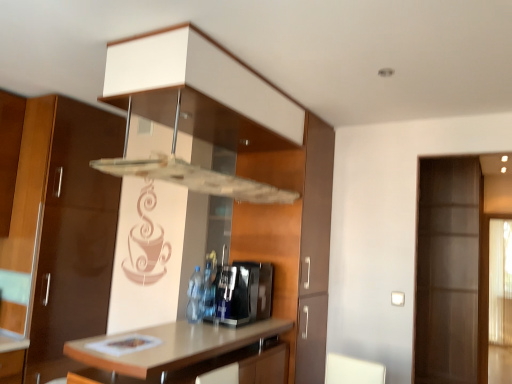
Question: Looking at the image, does sleek metallic coffee machine at center seem bigger or smaller compared to translucent plastic bottle at center?

Choices:
 (A) small
 (B) big

Answer: (B)

Question: In the image, is sleek metallic coffee machine at center positioned in front of or behind translucent plastic bottle at center?

Choices:
 (A) front
 (B) behind

Answer: (A)

Question: Which of these objects is positioned farthest from the light brown laminate countertop at center?

Choices:
 (A) transparent glass door at right
 (B) translucent plastic bottle at center
 (C) sleek metallic coffee machine at center

Answer: (A)

Question: Which object is the farthest from the transparent glass door at right?

Choices:
 (A) sleek metallic coffee machine at center
 (B) light brown laminate countertop at center
 (C) translucent plastic bottle at center

Answer: (C)